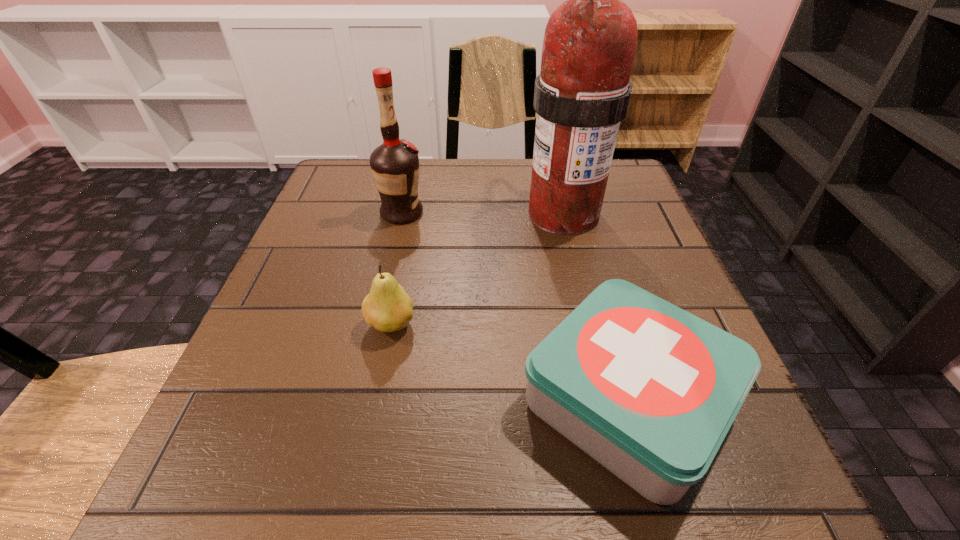
Identify the location of vacant space at the right edge. The width and height of the screenshot is (960, 540). (633, 219).

Find the location of a particular element. This screenshot has width=960, height=540. free space at the far left corner of the desktop is located at coordinates (369, 172).

Where is `free location at the near left corner of the desktop`? This screenshot has width=960, height=540. free location at the near left corner of the desktop is located at coordinates (282, 449).

You are a GUI agent. You are given a task and a screenshot of the screen. Output one action in this format:
    pyautogui.click(x=<x>, y=<y>)
    Task: Click on the vacant space at the near right corner
    
    Given the screenshot: What is the action you would take?
    pyautogui.click(x=773, y=515)

The image size is (960, 540). I want to click on free area in between the liquor and the pear, so click(x=396, y=269).

At what (x,y) coordinates should I click in order to perform the action: click on vacant space that is in between the liquor and the pear. Please return your answer as a coordinate pair (x, y). The height and width of the screenshot is (540, 960). Looking at the image, I should click on (396, 269).

Identify the location of vacant area that lies between the first-aid kit and the liquor. This screenshot has width=960, height=540. (515, 307).

Where is `vacant space that is in between the first-aid kit and the second tallest object`? The image size is (960, 540). vacant space that is in between the first-aid kit and the second tallest object is located at coordinates (515, 307).

This screenshot has width=960, height=540. I want to click on free space that is in between the pear and the tallest object, so click(x=477, y=268).

Where is `vacant space in between the liquor and the shortest object`? The height and width of the screenshot is (540, 960). vacant space in between the liquor and the shortest object is located at coordinates (515, 307).